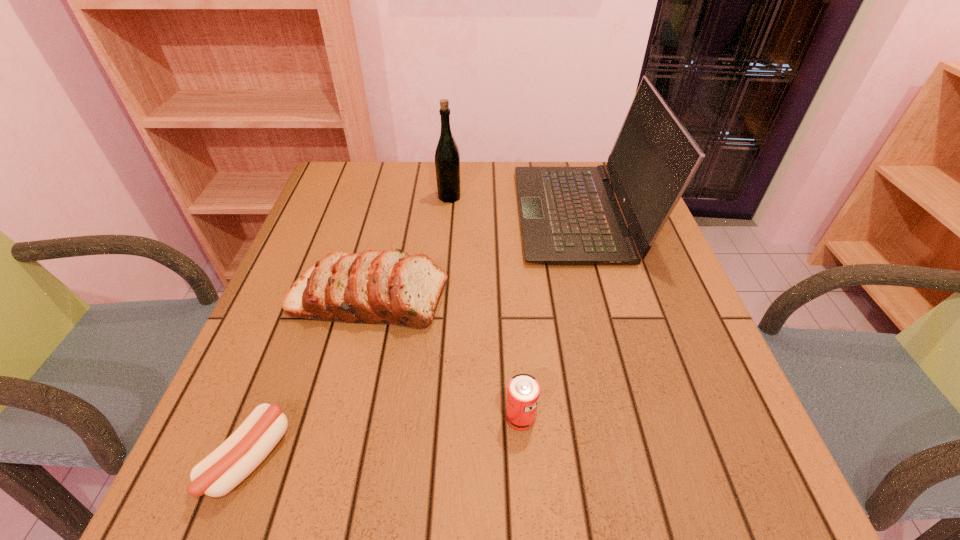
Find the location of a particular element. laptop computer is located at coordinates (569, 215).

Locate an element on the screen. The width and height of the screenshot is (960, 540). beer bottle is located at coordinates (447, 157).

You are a GUI agent. You are given a task and a screenshot of the screen. Output one action in this format:
    pyautogui.click(x=<x>, y=<y>)
    Task: Click on the third nearest object
    
    Given the screenshot: What is the action you would take?
    pyautogui.click(x=390, y=287)

I want to click on can, so pyautogui.click(x=523, y=391).

Find the location of `sausage`. sausage is located at coordinates (243, 451).

Identify the location of free location located on the screen of the laptop computer. pos(440,214).

The width and height of the screenshot is (960, 540). I want to click on vacant region located on the screen of the laptop computer, so click(x=424, y=214).

Locate an element on the screen. vacant space positioned on the screen of the laptop computer is located at coordinates (481, 214).

Identify the location of free space located on the right of the beer bottle. The image size is (960, 540). (606, 197).

Identify the location of blank space located on the front of the bread. This screenshot has width=960, height=540. (348, 383).